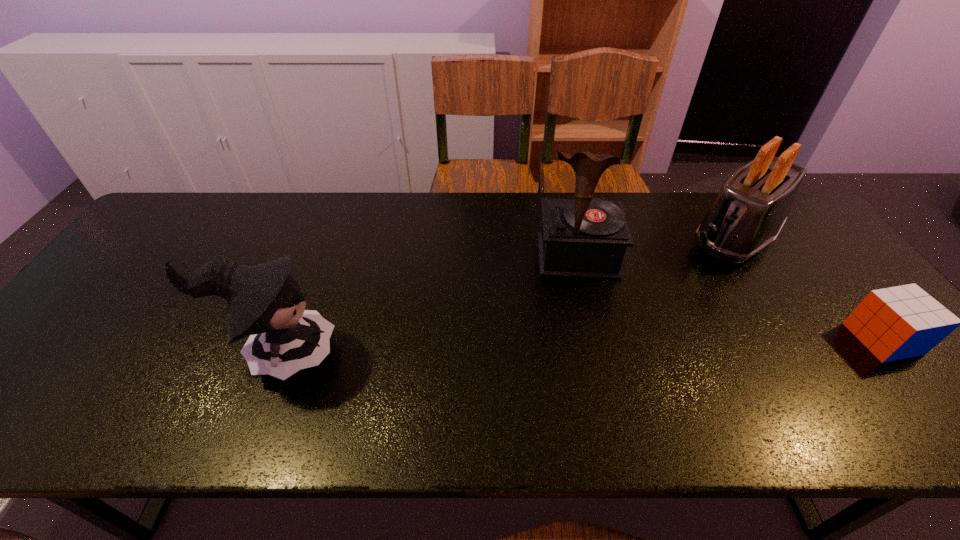
Find the location of a particular element. The image size is (960, 540). free space between the shortest object and the second object from left to right is located at coordinates (730, 298).

What are the coordinates of `free point between the toaster and the leftmost object` in the screenshot? It's located at (506, 296).

Locate an element on the screen. The image size is (960, 540). vacant area that lies between the doll and the third object from right to left is located at coordinates (428, 305).

What are the coordinates of `free space between the third object from right to left and the cube` in the screenshot? It's located at (730, 298).

At what (x,y) coordinates should I click in order to perform the action: click on vacant point located between the toaster and the leftmost object. Please return your answer as a coordinate pair (x, y). The height and width of the screenshot is (540, 960). Looking at the image, I should click on (506, 296).

Locate an element on the screen. This screenshot has width=960, height=540. object that is the third closest to the phonograph_record is located at coordinates (894, 323).

The height and width of the screenshot is (540, 960). I want to click on the second closest object to the phonograph_record, so click(264, 301).